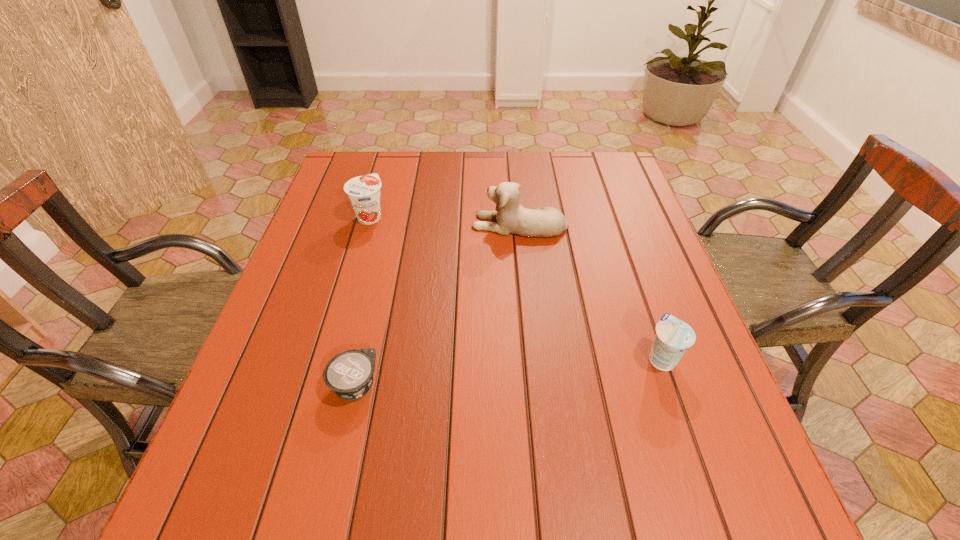
Image resolution: width=960 pixels, height=540 pixels. I want to click on blank area located on the front of the shortest yogurt, so click(335, 475).

Locate an element on the screen. object that is at the left edge is located at coordinates (364, 191).

This screenshot has width=960, height=540. Identify the location of object that is at the right edge. (673, 337).

Identify the location of vacant space at the far edge. This screenshot has width=960, height=540. (430, 165).

The image size is (960, 540). I want to click on vacant space at the near edge of the desktop, so click(635, 538).

Where is `free space at the left edge`? Image resolution: width=960 pixels, height=540 pixels. free space at the left edge is located at coordinates (292, 460).

In the image, there is a desktop. Where is `vacant space at the right edge`? The width and height of the screenshot is (960, 540). vacant space at the right edge is located at coordinates (609, 203).

This screenshot has height=540, width=960. In the image, there is a desktop. In order to click on vacant space at the far left corner in this screenshot , I will do `click(366, 152)`.

The width and height of the screenshot is (960, 540). I want to click on free space at the far right corner, so click(629, 186).

Locate an element on the screen. The width and height of the screenshot is (960, 540). blank region between the farthest yogurt and the shortest object is located at coordinates (363, 301).